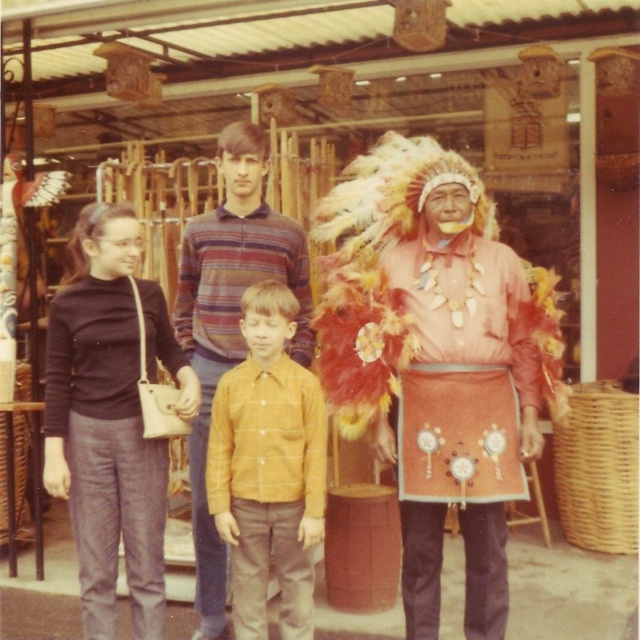
Question: Can you confirm if dark brown fabric pants at left is positioned below yellow checkered shirt at center?

Choices:
 (A) no
 (B) yes

Answer: (A)

Question: Which object is closer to the camera taking this photo?

Choices:
 (A) matte orange shirt at center
 (B) yellow checkered shirt at center
 (C) dark brown fabric pants at left

Answer: (A)

Question: Considering the relative positions of matte orange shirt at center and yellow checkered shirt at center in the image provided, where is matte orange shirt at center located with respect to yellow checkered shirt at center?

Choices:
 (A) left
 (B) right

Answer: (B)

Question: Among these objects, which one is farthest from the camera?

Choices:
 (A) yellow checkered shirt at center
 (B) dark brown fabric pants at left
 (C) matte orange shirt at center

Answer: (A)

Question: Can you confirm if matte orange shirt at center is positioned above dark brown fabric pants at left?

Choices:
 (A) no
 (B) yes

Answer: (B)

Question: Among these objects, which one is farthest from the camera?

Choices:
 (A) dark brown fabric pants at left
 (B) yellow checkered shirt at center
 (C) matte orange shirt at center

Answer: (B)